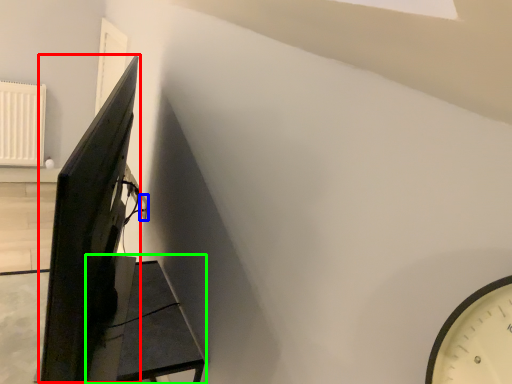
Question: Which object is positioned closest to computer monitor (highlighted by a red box)? Select from electric outlet (highlighted by a blue box) and furniture (highlighted by a green box).

Choices:
 (A) electric outlet
 (B) furniture

Answer: (B)